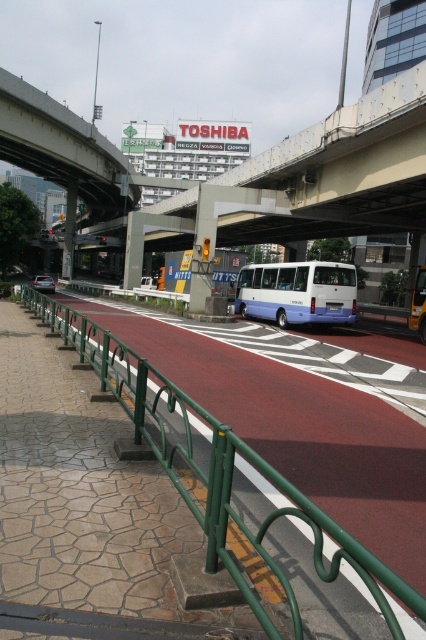
Question: Is white matte bus at center below metallic silver car at center?

Choices:
 (A) yes
 (B) no

Answer: (A)

Question: Does green metallic rail at lower left appear on the right side of metallic silver car at center?

Choices:
 (A) no
 (B) yes

Answer: (B)

Question: Which of the following is the closest to the observer?

Choices:
 (A) green metallic rail at lower left
 (B) white matte bus at center
 (C) metallic silver car at center

Answer: (A)

Question: Which is farther from the green metallic rail at lower left?

Choices:
 (A) white matte bus at center
 (B) metallic silver car at center

Answer: (B)

Question: Which point is closer to the camera taking this photo?

Choices:
 (A) (307, 316)
 (B) (276, 566)

Answer: (B)

Question: Is white matte bus at center wider than metallic silver car at center?

Choices:
 (A) no
 (B) yes

Answer: (A)